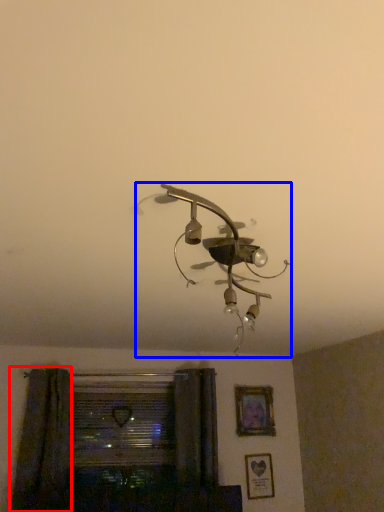
Question: Which of the following is the closest to the observer, curtain (highlighted by a red box) or lamp (highlighted by a blue box)?

Choices:
 (A) curtain
 (B) lamp

Answer: (B)